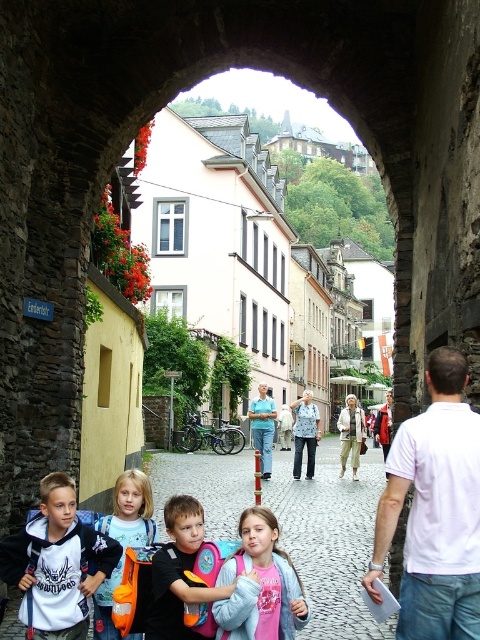
Can you confirm if white cotton hoodie at lower left is shorter than light blue denim jacket at lower center?

Correct, white cotton hoodie at lower left is not as tall as light blue denim jacket at lower center.

Which is more to the left, white cotton hoodie at lower left or light blue denim jacket at lower center?

white cotton hoodie at lower left is more to the left.

Does point (7, 582) come behind point (152, 627)?

Yes, point (7, 582) is behind point (152, 627).

This screenshot has width=480, height=640. I want to click on white cotton hoodie at lower left, so coord(57,563).

Who is positioned more to the right, light blue denim jacket at lower center or denim jacket at center?

denim jacket at center is more to the right.

Between light blue denim jacket at lower center and denim jacket at center, which one has less height?

With less height is light blue denim jacket at lower center.

Who is more forward, (183, 500) or (297, 477)?

Point (183, 500) is more forward.

I want to click on light blue denim jacket at lower center, so click(179, 572).

Between pink fabric backpack at center and denim jacket at center, which one appears on the right side from the viewer's perspective?

denim jacket at center is more to the right.

Which of these two, pink fabric backpack at center or denim jacket at center, stands shorter?

pink fabric backpack at center is shorter.

What do you see at coordinates (260, 584) in the screenshot? I see `pink fabric backpack at center` at bounding box center [260, 584].

The image size is (480, 640). I want to click on pink fabric backpack at center, so click(260, 584).